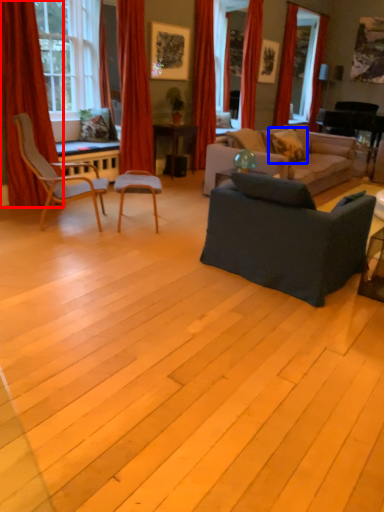
Question: Which of the following is the closest to the observer, curtain (highlighted by a red box) or pillow (highlighted by a blue box)?

Choices:
 (A) curtain
 (B) pillow

Answer: (A)